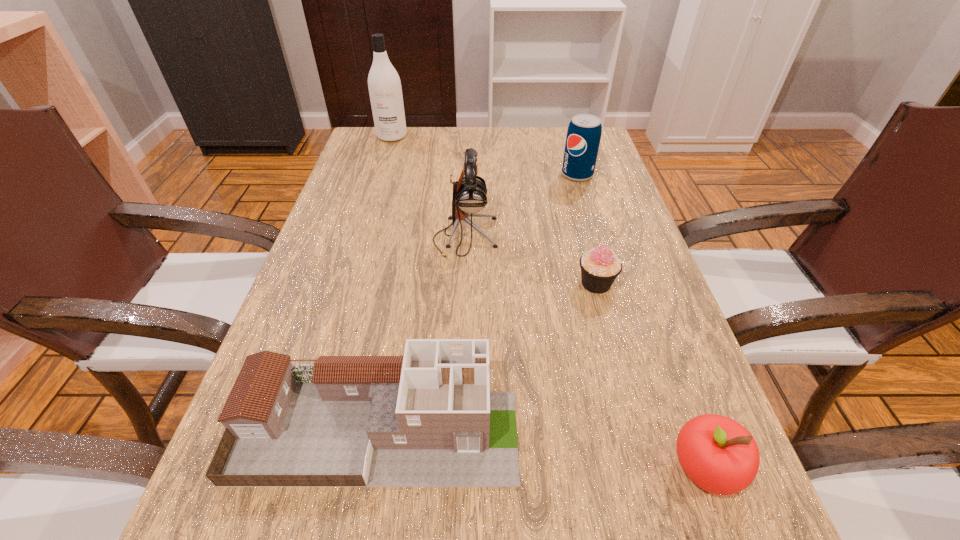
Identify the location of vacant area between the apple and the third farthest object. (585, 353).

Identify the location of vacant region between the earphone and the apple. The height and width of the screenshot is (540, 960). tap(585, 353).

Image resolution: width=960 pixels, height=540 pixels. I want to click on vacant point located between the third farthest object and the pop, so click(x=521, y=206).

This screenshot has height=540, width=960. I want to click on free space between the shampoo and the cupcake, so click(x=494, y=210).

Locate an element on the screen. free space between the shortest object and the farthest object is located at coordinates (494, 210).

Image resolution: width=960 pixels, height=540 pixels. I want to click on free spot between the fifth nearest object and the apple, so click(x=641, y=322).

You are a GUI agent. You are given a task and a screenshot of the screen. Output one action in this format:
    pyautogui.click(x=<x>, y=<y>)
    Task: Click on the blank region between the fifth shortest object and the apple
    The height and width of the screenshot is (540, 960).
    Given the screenshot: What is the action you would take?
    pyautogui.click(x=585, y=353)

Select which object appears as the fifth closest to the apple. Please provide its 2D coordinates. Your answer should be formatted as a tuple, i.e. [(x, y)], where the tuple contains the x and y coordinates of a point satisfying the conditions above.

[(384, 84)]

You are a GUI agent. You are given a task and a screenshot of the screen. Output one action in this format:
    pyautogui.click(x=<x>, y=<y>)
    Task: Click on the object that can be found as the fourth closest to the earphone
    
    Given the screenshot: What is the action you would take?
    pyautogui.click(x=384, y=84)

Where is `free space that satisfies the following two spatial constraints: 1. on the front-facing side of the farthest object; 2. on the right side of the cupcake`? This screenshot has width=960, height=540. free space that satisfies the following two spatial constraints: 1. on the front-facing side of the farthest object; 2. on the right side of the cupcake is located at coordinates (347, 284).